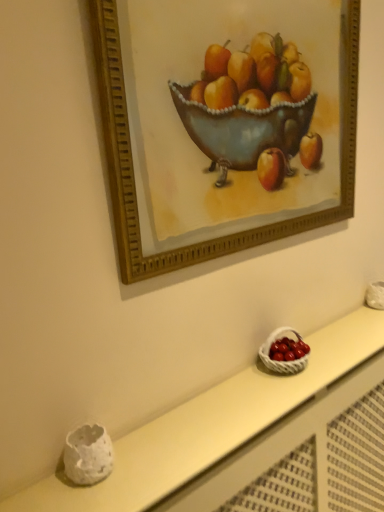
The width and height of the screenshot is (384, 512). I want to click on free area below gold-framed picture at upper center (from a real-world perspective), so click(x=255, y=356).